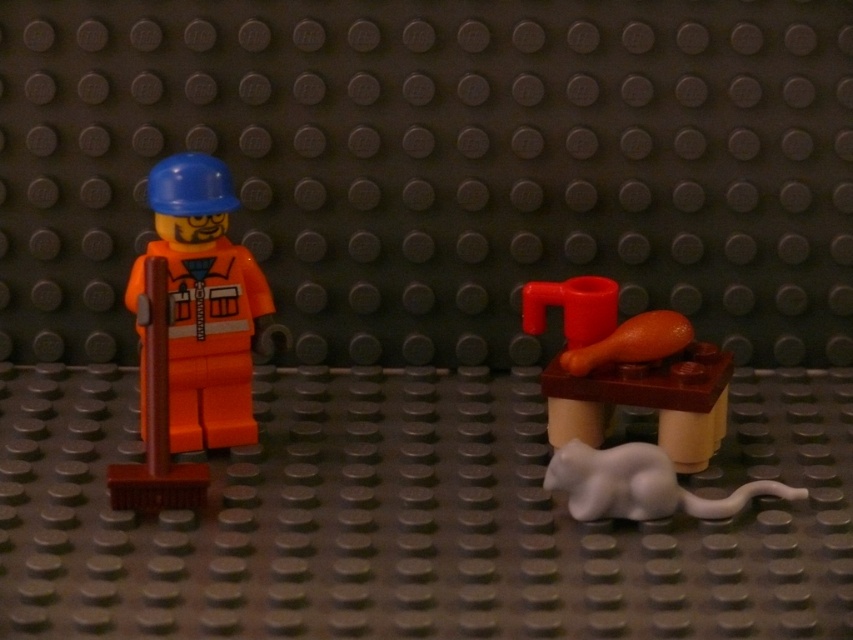
You are a delivery robot with a 12 inch wide package. You need to deliver this package to the smooth brown table at right while avoiding the orange matte construction worker at left. Can you fit through the space between them?

The distance between the smooth brown table at right and the orange matte construction worker at left is 15.34 inches. Since the package is 12 inches wide, the robot can fit through the space as 15.34 inches is wider than 12 inches.

In the LEGO scene, you see an orange matte construction worker at left and a white matte mouse at lower right. Which object is taller?

The orange matte construction worker at left is taller than the white matte mouse at lower right.